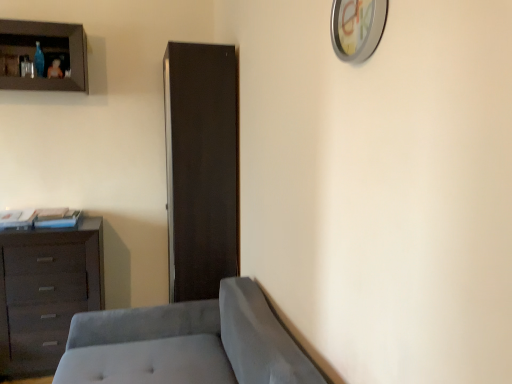
Question: Does suede gray studio couch at lower left have a smaller size compared to matte black cabinet at center?

Choices:
 (A) no
 (B) yes

Answer: (A)

Question: Considering the relative sizes of suede gray studio couch at lower left and matte black cabinet at center in the image provided, is suede gray studio couch at lower left taller than matte black cabinet at center?

Choices:
 (A) no
 (B) yes

Answer: (A)

Question: Does suede gray studio couch at lower left have a lesser width compared to matte black cabinet at center?

Choices:
 (A) yes
 (B) no

Answer: (B)

Question: Is suede gray studio couch at lower left behind matte black cabinet at center?

Choices:
 (A) yes
 (B) no

Answer: (B)

Question: Is suede gray studio couch at lower left to the right of matte black cabinet at center from the viewer's perspective?

Choices:
 (A) yes
 (B) no

Answer: (B)

Question: From a real-world perspective, is suede gray studio couch at lower left beneath matte black cabinet at center?

Choices:
 (A) no
 (B) yes

Answer: (B)

Question: Is matte black cabinet at center completely or partially outside of suede gray studio couch at lower left?

Choices:
 (A) no
 (B) yes

Answer: (B)

Question: Does matte black cabinet at center have a lesser height compared to suede gray studio couch at lower left?

Choices:
 (A) yes
 (B) no

Answer: (B)

Question: Are matte black cabinet at center and suede gray studio couch at lower left beside each other?

Choices:
 (A) no
 (B) yes

Answer: (A)

Question: From a real-world perspective, is matte black cabinet at center physically above suede gray studio couch at lower left?

Choices:
 (A) no
 (B) yes

Answer: (B)

Question: From a real-world perspective, is matte black cabinet at center beneath suede gray studio couch at lower left?

Choices:
 (A) yes
 (B) no

Answer: (B)

Question: Is matte black cabinet at center in front of suede gray studio couch at lower left?

Choices:
 (A) yes
 (B) no

Answer: (B)

Question: From the image's perspective, is matte brown cabinet at upper left on top of dark brown wooden chest of drawers at left?

Choices:
 (A) no
 (B) yes

Answer: (B)